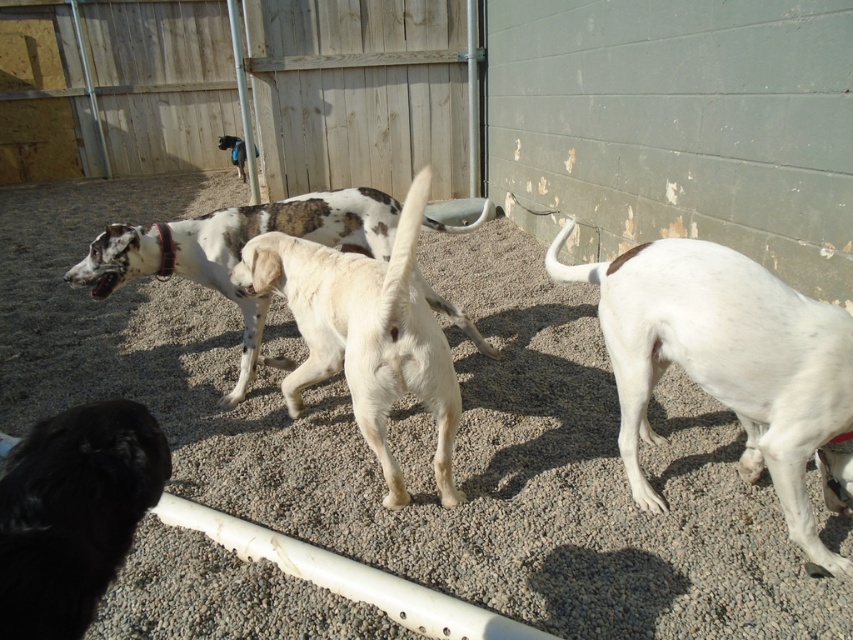
Who is taller, gray gravel at center or white fur dog at center?

Standing taller between the two is white fur dog at center.

Which of these two, gray gravel at center or white fur dog at center, stands shorter?

gray gravel at center

The image size is (853, 640). Describe the element at coordinates (422, 435) in the screenshot. I see `gray gravel at center` at that location.

This screenshot has height=640, width=853. What are the coordinates of `gray gravel at center` in the screenshot? It's located at (422, 435).

Is point (791, 449) behind point (345, 273)?

No, (791, 449) is in front of (345, 273).

Between white smooth dog at right and white fur dog at center, which one appears on the right side from the viewer's perspective?

Positioned to the right is white smooth dog at right.

Describe the element at coordinates (724, 360) in the screenshot. I see `white smooth dog at right` at that location.

In order to click on white smooth dog at right in this screenshot , I will do `click(724, 360)`.

Which is above, gray gravel at center or white smooth dog at right?

white smooth dog at right is above.

Does gray gravel at center have a greater height compared to white smooth dog at right?

No, gray gravel at center is not taller than white smooth dog at right.

Locate an element on the screen. This screenshot has height=640, width=853. gray gravel at center is located at coordinates (422, 435).

The height and width of the screenshot is (640, 853). In order to click on gray gravel at center in this screenshot , I will do `click(422, 435)`.